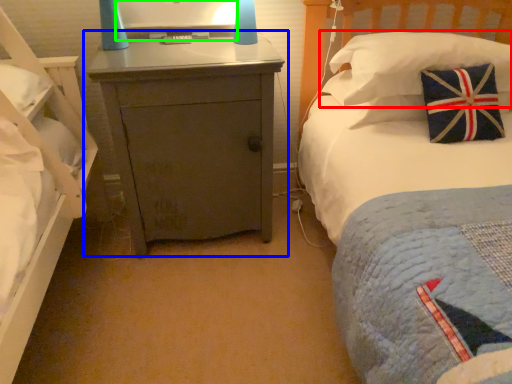
Question: Estimate the real-world distances between objects in this image. Which object is farther from pillow (highlighted by a red box), nightstand (highlighted by a blue box) or computer monitor (highlighted by a green box)?

Choices:
 (A) nightstand
 (B) computer monitor

Answer: (B)